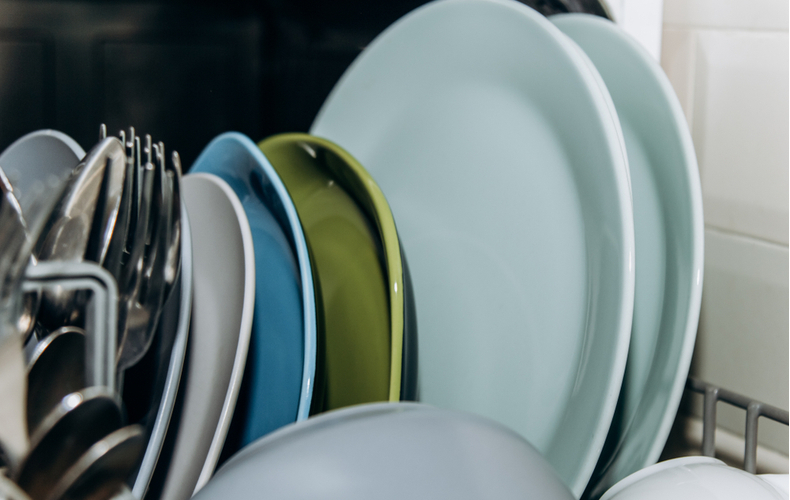
This screenshot has width=790, height=500. Identify the location of plates in image. (659, 151), (563, 193), (365, 241), (283, 276), (234, 290), (179, 329), (36, 166).